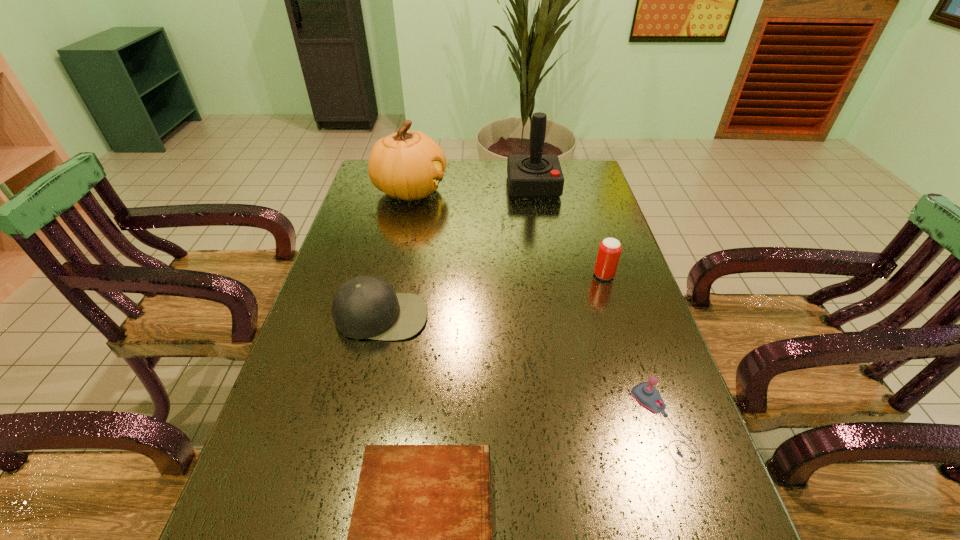
This screenshot has height=540, width=960. Find the location of `vacant space located on the brim of the fourth farthest object`. vacant space located on the brim of the fourth farthest object is located at coordinates (347, 469).

What are the coordinates of `free space located on the back of the nearer joystick` in the screenshot? It's located at (621, 299).

What are the coordinates of `joystick present at the far edge` in the screenshot? It's located at (529, 176).

Identify the location of pumpkin located in the far edge section of the desktop. (409, 165).

Locate an element on the screen. The height and width of the screenshot is (540, 960). pumpkin located in the left edge section of the desktop is located at coordinates (409, 165).

Locate an element on the screen. The height and width of the screenshot is (540, 960). cap that is at the left edge is located at coordinates (363, 307).

Identify the location of beer can that is at the right edge. [x=609, y=251].

This screenshot has height=540, width=960. Identify the location of object that is at the far left corner. (409, 165).

Locate an element on the screen. This screenshot has height=540, width=960. object at the far right corner is located at coordinates [x=529, y=176].

The width and height of the screenshot is (960, 540). In the image, there is a desktop. In order to click on vacant space at the far edge in this screenshot , I will do `click(471, 185)`.